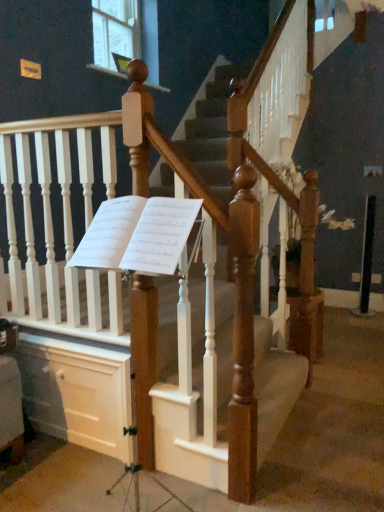
Image resolution: width=384 pixels, height=512 pixels. What are the coordinates of `empty space that is ontop of white painted wood drawer at lower left (from a real-world perspective)` in the screenshot? It's located at pyautogui.click(x=62, y=342).